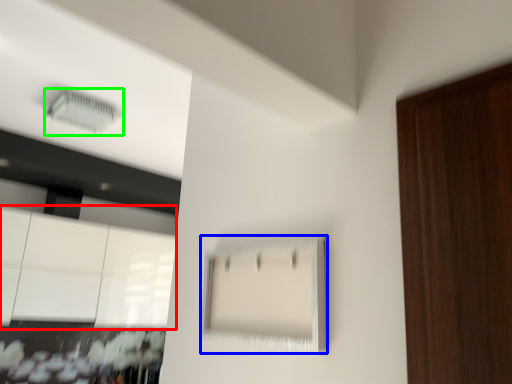
Question: Based on their relative distances, which object is farther from cabinetry (highlighted by a red box)? Choose from cabinetry (highlighted by a blue box) and air conditioning (highlighted by a green box).

Choices:
 (A) cabinetry
 (B) air conditioning

Answer: (A)